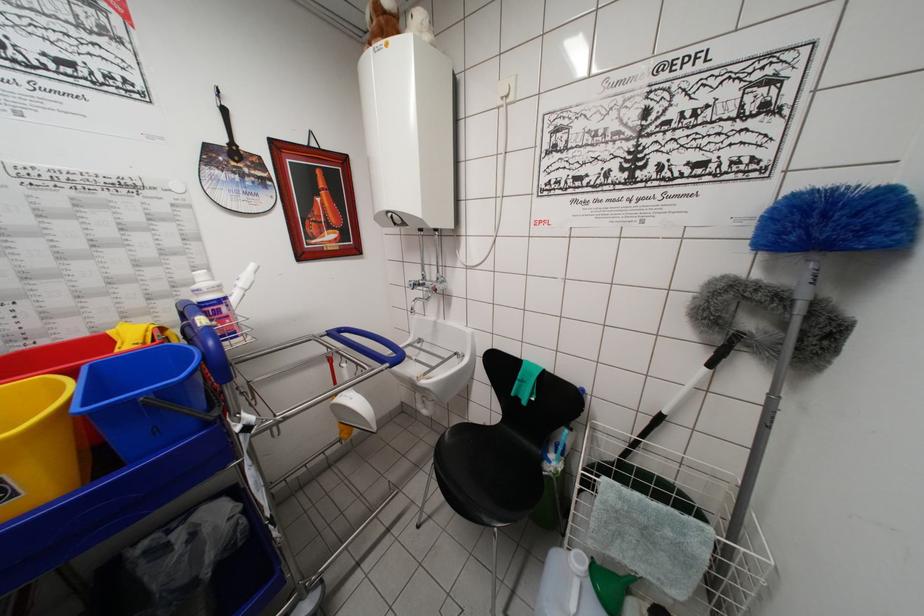
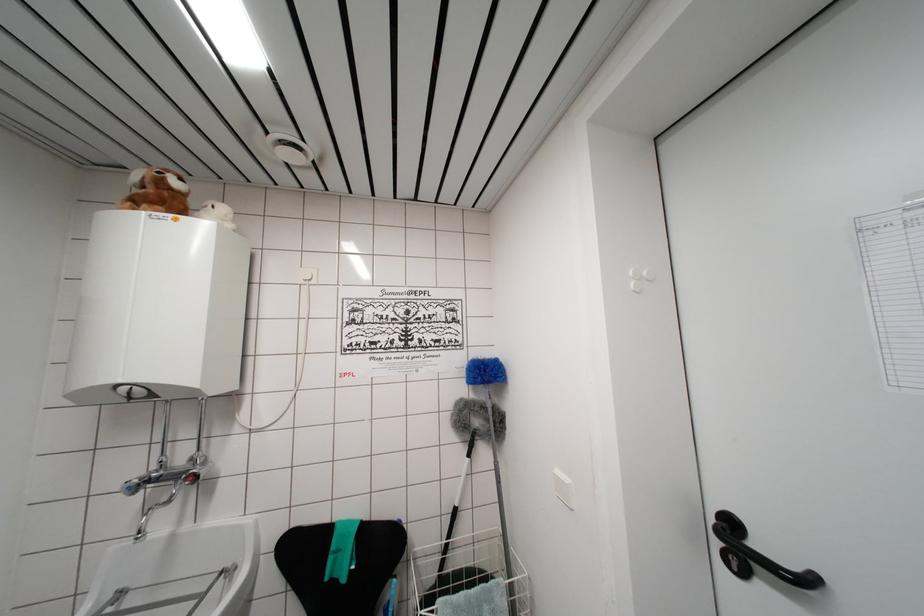
In the second image, find the point that corresponds to point 386,39 in the first image.

(168, 209)